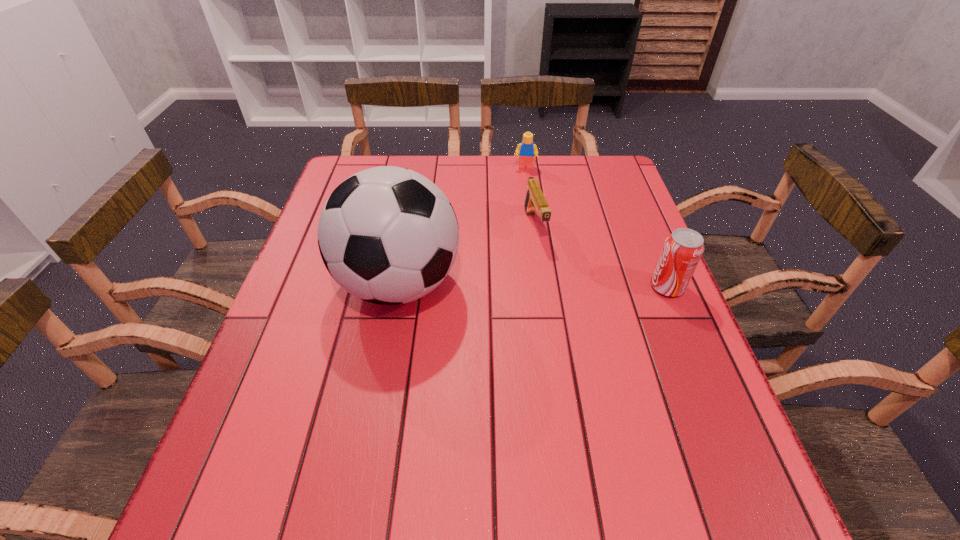
You are a GUI agent. You are given a task and a screenshot of the screen. Output one action in this format:
    pyautogui.click(x=<x>, y=<y>)
    Task: Click on the free space located 0.140m on the front-facing side of the farthest object
    The image size is (960, 540).
    Given the screenshot: What is the action you would take?
    pyautogui.click(x=523, y=197)

Identify the location of free location located 0.220m on the front-facing side of the farthest object. (521, 214).

Locate an element on the screen. The height and width of the screenshot is (540, 960). free space located on the front-facing side of the farthest object is located at coordinates (521, 216).

Locate an element on the screen. The image size is (960, 540). free region located 0.050m at the barrel of the pistol is located at coordinates (544, 259).

Locate an element on the screen. free space located 0.050m at the barrel of the pistol is located at coordinates pyautogui.click(x=544, y=259).

Image resolution: width=960 pixels, height=540 pixels. I want to click on vacant region located at the barrel of the pistol, so click(x=586, y=366).

I want to click on object that is at the far edge, so click(x=526, y=150).

Identify the location of object positioned at the left edge. (388, 235).

This screenshot has height=540, width=960. Identify the location of object that is positioned at the right edge. (681, 253).

Locate an element on the screen. vacant space at the far edge is located at coordinates (490, 166).